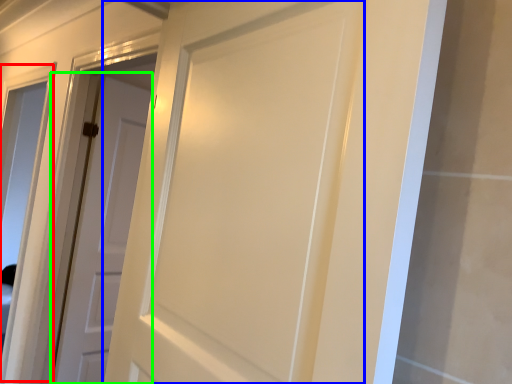
Question: Which object is positioned closest to window (highlighted by a red box)? Select from door (highlighted by a blue box) and door (highlighted by a green box).

Choices:
 (A) door
 (B) door

Answer: (B)